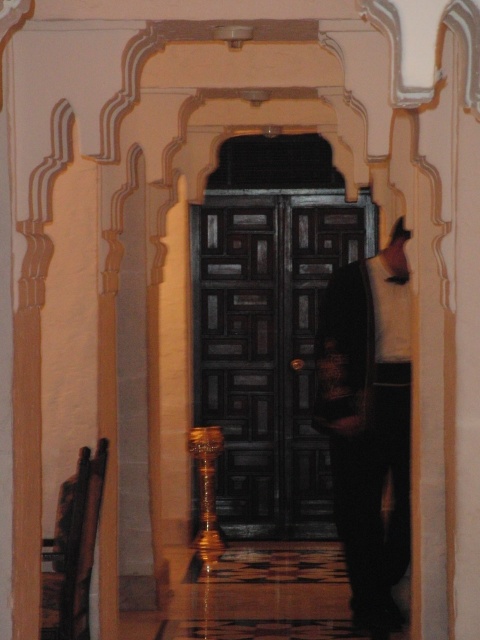
Question: Is dark wood door at center further to camera compared to dark brown leather jacket at center?

Choices:
 (A) no
 (B) yes

Answer: (B)

Question: Does dark wood door at center have a lesser width compared to dark brown leather jacket at center?

Choices:
 (A) yes
 (B) no

Answer: (B)

Question: Which point appears closest to the camera in this image?

Choices:
 (A) click(x=400, y=298)
 (B) click(x=285, y=502)

Answer: (A)

Question: Does dark wood door at center lie behind dark brown leather jacket at center?

Choices:
 (A) yes
 (B) no

Answer: (A)

Question: Which of the following is the farthest from the observer?

Choices:
 (A) dark wood door at center
 (B) dark brown leather jacket at center

Answer: (A)